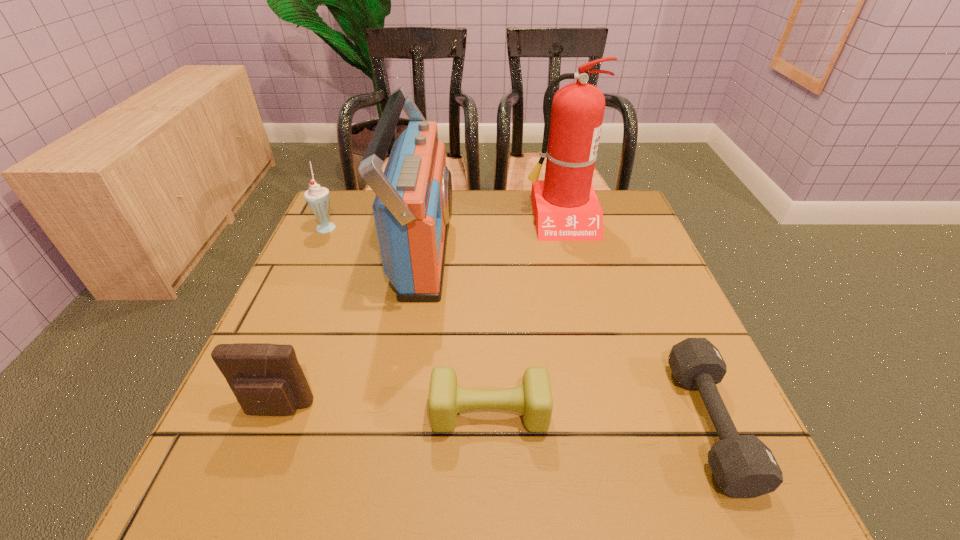
Find the location of a particular element. The height and width of the screenshot is (540, 960). fire extinguisher is located at coordinates (566, 208).

Where is `the second object from right to left`? This screenshot has width=960, height=540. the second object from right to left is located at coordinates (566, 208).

I want to click on radio receiver, so click(x=413, y=205).

You are a GUI agent. You are given a task and a screenshot of the screen. Output one action in this format:
    pyautogui.click(x=<x>, y=<y>)
    Task: Click on the milkshake
    The image size is (960, 540).
    Given the screenshot: What is the action you would take?
    pyautogui.click(x=318, y=198)

The height and width of the screenshot is (540, 960). In order to click on pouch in this screenshot , I will do `click(266, 379)`.

The width and height of the screenshot is (960, 540). What are the coordinates of `the left dumbbell` in the screenshot? It's located at (533, 398).

I want to click on the right dumbbell, so click(743, 466).

Identify the location of vacant area situated on the front-facing side of the fire extinguisher. This screenshot has height=540, width=960. (597, 367).

Image resolution: width=960 pixels, height=540 pixels. I want to click on vacant region located 0.090m on the front-facing side of the second tallest object, so click(489, 251).

You are a GUI agent. You are given a task and a screenshot of the screen. Output one action in this format:
    pyautogui.click(x=<x>, y=<y>)
    Task: Click on the free space located on the straw side of the milkshake
    
    Given the screenshot: What is the action you would take?
    pyautogui.click(x=444, y=226)